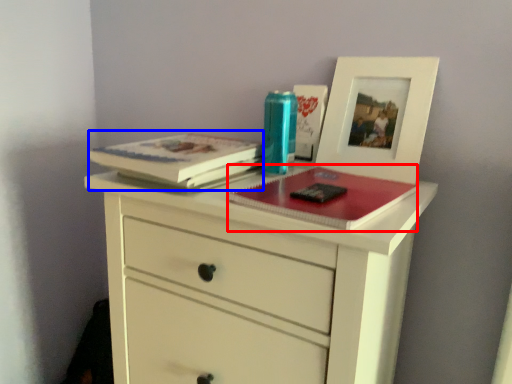
Question: Which point is closer to the camera, magazine (highlighted by a red box) or paperback book (highlighted by a blue box)?

Choices:
 (A) magazine
 (B) paperback book

Answer: (A)